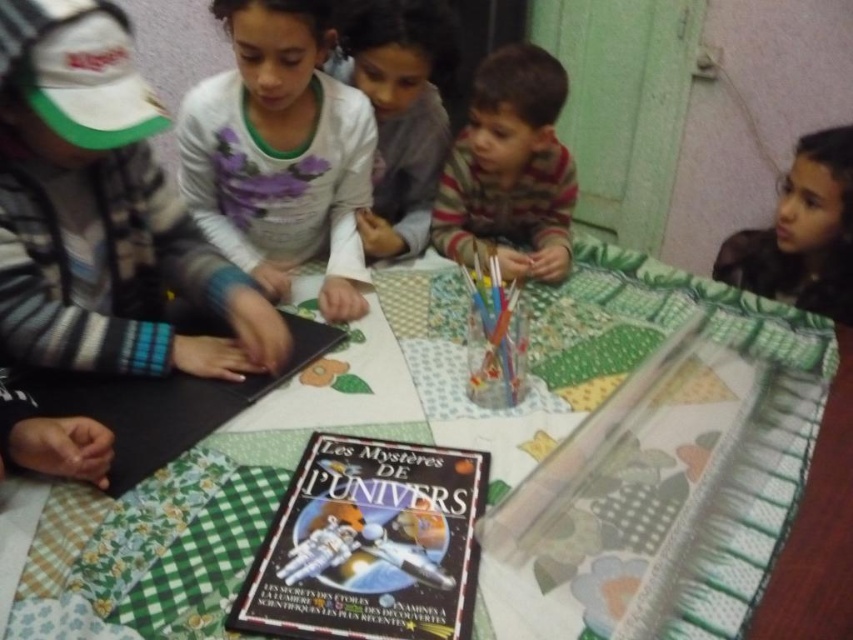
You are standing in front of the table with the colorful tablecloth and want to reach two points on the table. The first point is at coordinate point (128,572) and the second is at point (45,403). Which point is closer to you?

Point (128,572) is closer to the viewer than point (45,403).

You are a teacher observing the children at the green quilted table at center and the hardcover book at lower left. From your perspective, which object is positioned to the left?

The hardcover book at lower left is positioned to the left of the green quilted table at center.

You are a teacher observing the children at the table. You notice the hardcover book at lower left and the smooth brown hair at upper right. Which object is wider?

The hardcover book at lower left might be wider than smooth brown hair at upper right.